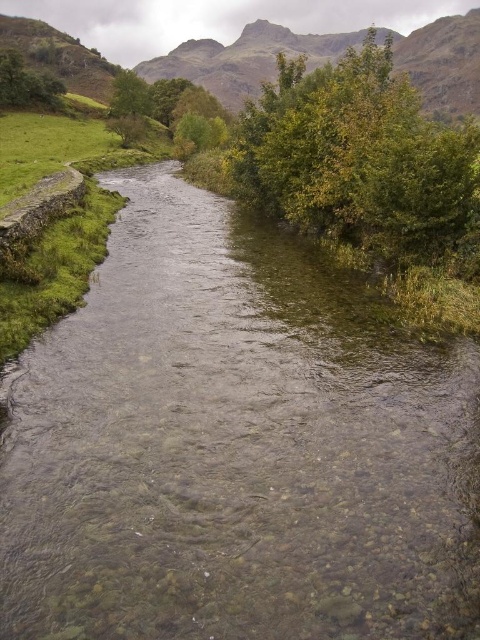
Is green leafy tree at upper center further to camera compared to rugged stone mountain at upper center?

No.

Between green leafy tree at upper center and rugged stone mountain at upper center, which one appears on the left side from the viewer's perspective?

rugged stone mountain at upper center is more to the left.

Is point (305, 154) less distant than point (305, 36)?

Yes, it is in front of point (305, 36).

In order to click on green leafy tree at upper center in this screenshot , I will do `click(360, 157)`.

Does green leafy tree at upper center lie behind green leafy tree at upper left?

No.

Does green leafy tree at upper center appear under green leafy tree at upper left?

Indeed, green leafy tree at upper center is positioned under green leafy tree at upper left.

The width and height of the screenshot is (480, 640). Describe the element at coordinates (360, 157) in the screenshot. I see `green leafy tree at upper center` at that location.

Identify the location of green leafy tree at upper center. (360, 157).

Does rugged stone mountain at upper center lie behind green leafy tree at upper left?

Yes, it is.

Is rugged stone mountain at upper center thinner than green leafy tree at upper left?

No, rugged stone mountain at upper center is not thinner than green leafy tree at upper left.

Between point (280, 49) and point (34, 97), which one is positioned behind?

Point (280, 49)

The width and height of the screenshot is (480, 640). Identify the location of rugged stone mountain at upper center. (243, 58).